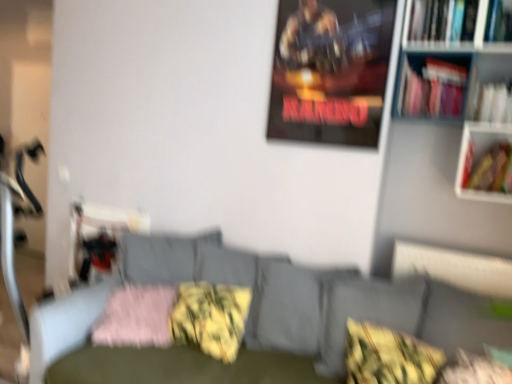
Question: Would you say textured gray couch at center is inside or outside yellow-green textured pillow at center, which is the second pillow from right to left?

Choices:
 (A) inside
 (B) outside

Answer: (B)

Question: Considering the positions of point (289, 324) and point (429, 380), is point (289, 324) closer or farther from the camera than point (429, 380)?

Choices:
 (A) closer
 (B) farther

Answer: (B)

Question: Estimate the real-world distances between objects in this image. Which object is farther from the yellow-green textured pillow at lower right, placed as the first pillow when sorted from right to left?

Choices:
 (A) metallic poster at upper center
 (B) textured gray couch at center
 (C) yellow-green textured pillow at center, placed as the 2th pillow when sorted from left to right
 (D) white paper at upper right, arranged as the second book when ordered from the bottom
 (E) hardcover book at upper right, acting as the 3th book starting from the bottom

Answer: (E)

Question: Estimate the real-world distances between objects in this image. Which object is farther from the textured gray couch at center?

Choices:
 (A) yellow-green textured pillow at lower right, acting as the fourth pillow starting from the left
 (B) hardcover book at upper right, the first book viewed from the top
 (C) white paper at upper right, arranged as the second book when ordered from the bottom
 (D) black leather swivel chair at center
 (E) hardcover book at right, placed as the 1th book when sorted from bottom to top

Answer: (B)